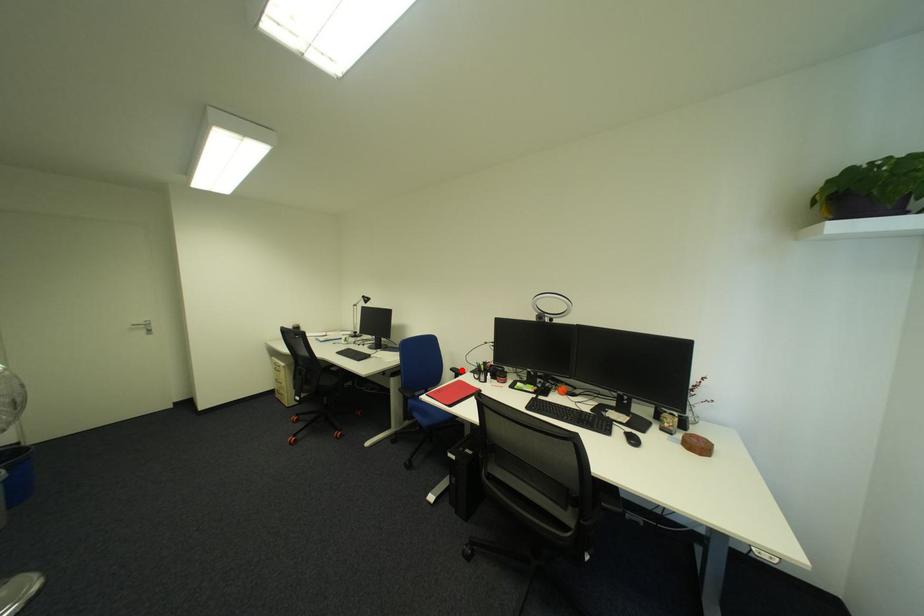
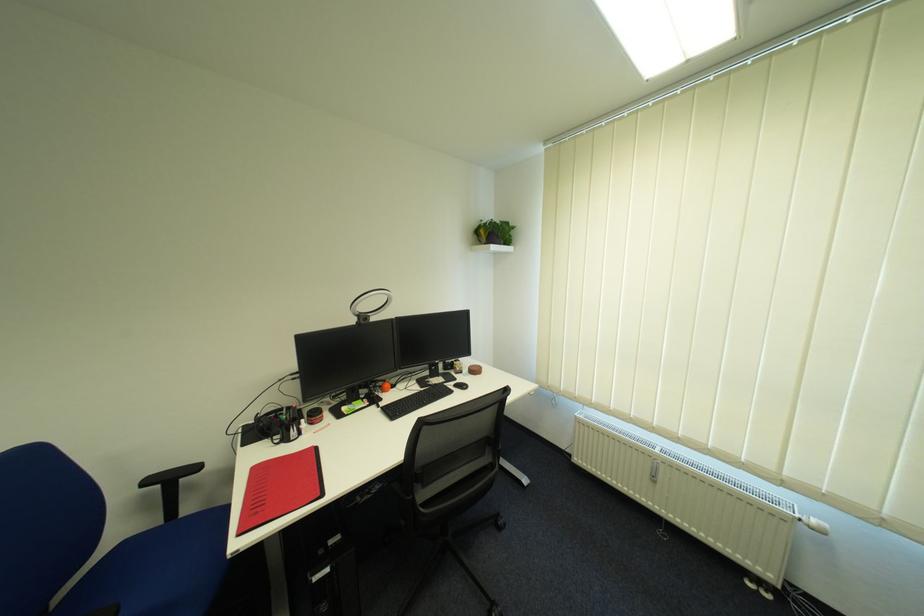
Question: I am providing you with two images of the same scene from different viewpoints. In image1, a red point is highlighted. Considering the same 3D point in image2, which of the following is correct?

Choices:
 (A) It is closer
 (B) It is farther

Answer: (A)